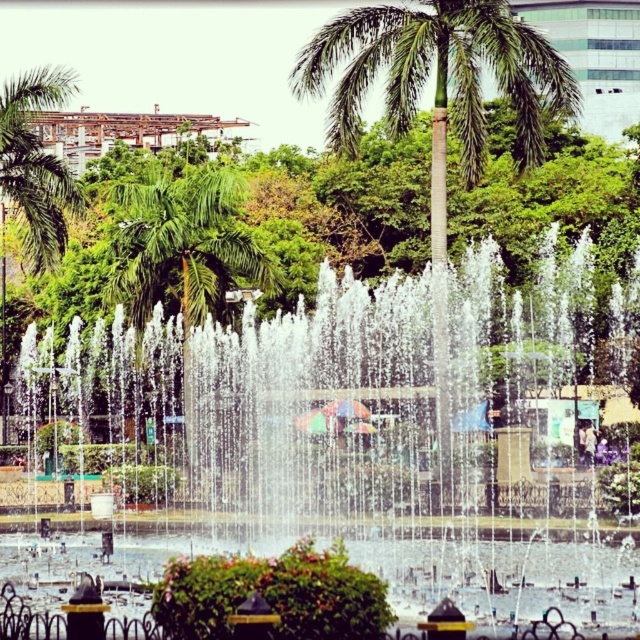
Question: Which is nearer to the clear water fountain at center?

Choices:
 (A) green leafy palm tree at center
 (B) green leafy palm tree at upper left

Answer: (A)

Question: Estimate the real-world distances between objects in this image. Which object is closer to the clear water fountain at center?

Choices:
 (A) green leafy palm tree at upper left
 (B) green leafy palm tree at center

Answer: (B)

Question: Does green leafy palm tree at center appear under green leafy palm tree at upper left?

Choices:
 (A) yes
 (B) no

Answer: (A)

Question: Estimate the real-world distances between objects in this image. Which object is closer to the green leafy palm tree at upper left?

Choices:
 (A) clear water fountain at center
 (B) green leafy palm tree at center

Answer: (A)

Question: Can you confirm if green leafy palm tree at center is positioned above green leafy palm tree at upper left?

Choices:
 (A) yes
 (B) no

Answer: (B)

Question: Is clear water fountain at center below green leafy palm tree at upper left?

Choices:
 (A) yes
 (B) no

Answer: (A)